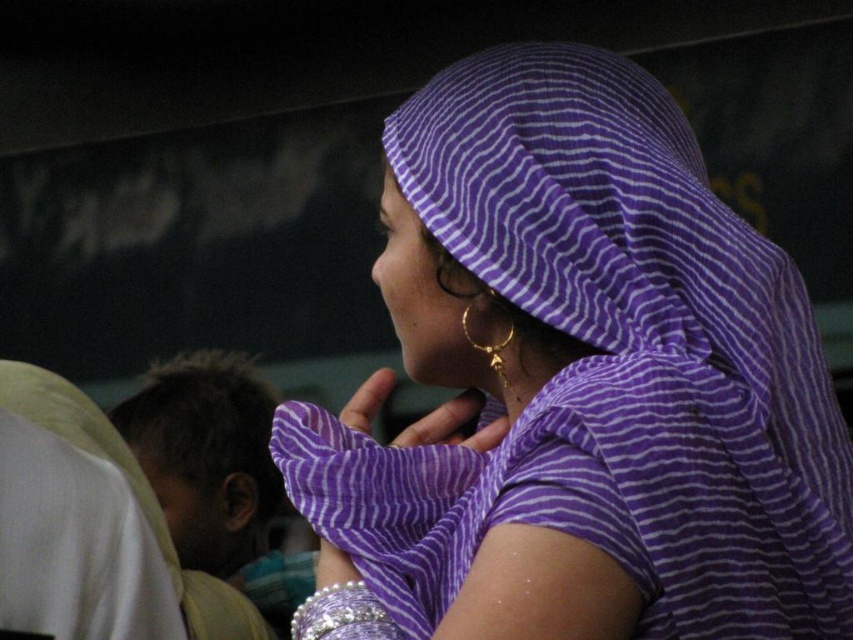
You are a photographer adjusting the lighting in the scene. You notice the goldeffectearring at center and the silver metallic bracelet at lower center. Which object is closer to the camera, and why?

The goldeffectearring at center is closer to the camera because the silver metallic bracelet at lower center is behind it, making the earring appear in front.